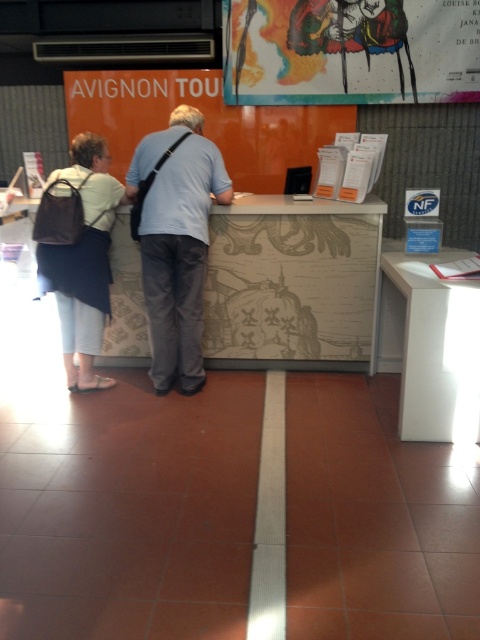
Question: Which point is closer to the camera?

Choices:
 (A) matte black backpack at left
 (B) white glossy table at lower right
 (C) light blue shirt at center
 (D) colorful painted figure at upper center

Answer: (B)

Question: Which is farther from the light blue shirt at center?

Choices:
 (A) white glossy table at lower right
 (B) matte black backpack at left
 (C) colorful painted figure at upper center

Answer: (C)

Question: Which object appears farthest from the camera in this image?

Choices:
 (A) colorful painted figure at upper center
 (B) light blue shirt at center
 (C) beige textured desk at center
 (D) white glossy table at lower right

Answer: (A)

Question: Is beige textured desk at center closer to the viewer compared to white glossy table at lower right?

Choices:
 (A) yes
 (B) no

Answer: (B)

Question: Can you confirm if beige textured desk at center is positioned to the right of white glossy table at lower right?

Choices:
 (A) yes
 (B) no

Answer: (B)

Question: Is colorful painted figure at upper center positioned at the back of light blue shirt at center?

Choices:
 (A) no
 (B) yes

Answer: (B)